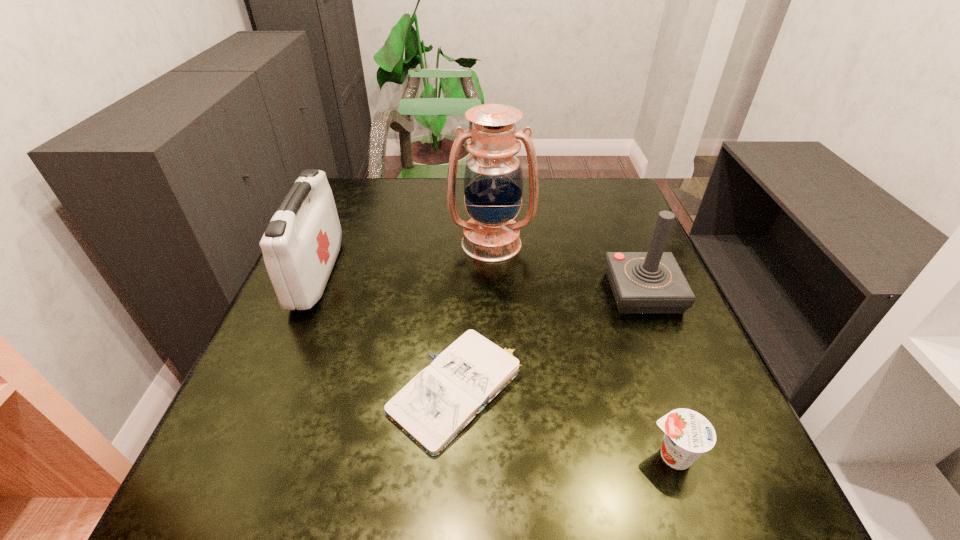
Find the location of `object that is at the near edge`. object that is at the near edge is located at coordinates [x=688, y=434].

The image size is (960, 540). In order to click on object that is at the left edge in this screenshot , I will do (301, 243).

Where is `joystick that is positioned at the right edge`? The width and height of the screenshot is (960, 540). joystick that is positioned at the right edge is located at coordinates click(x=652, y=282).

Where is `yogurt at the right edge`? yogurt at the right edge is located at coordinates (688, 434).

The image size is (960, 540). In order to click on object that is at the near right corner in this screenshot , I will do click(x=688, y=434).

This screenshot has width=960, height=540. I want to click on vacant space at the far edge, so click(432, 214).

I want to click on free space at the near edge, so click(629, 524).

Where is `vacant space at the left edge of the desktop`? This screenshot has height=540, width=960. vacant space at the left edge of the desktop is located at coordinates click(348, 306).

At what (x,y) coordinates should I click in order to perform the action: click on blank space at the right edge of the desktop. Please return your answer as a coordinate pair (x, y). The width and height of the screenshot is (960, 540). Looking at the image, I should click on (713, 369).

At what (x,y) coordinates should I click in order to perform the action: click on vacant space at the far left corner of the desktop. Please return your answer as a coordinate pair (x, y). The image size is (960, 540). Looking at the image, I should click on (349, 215).